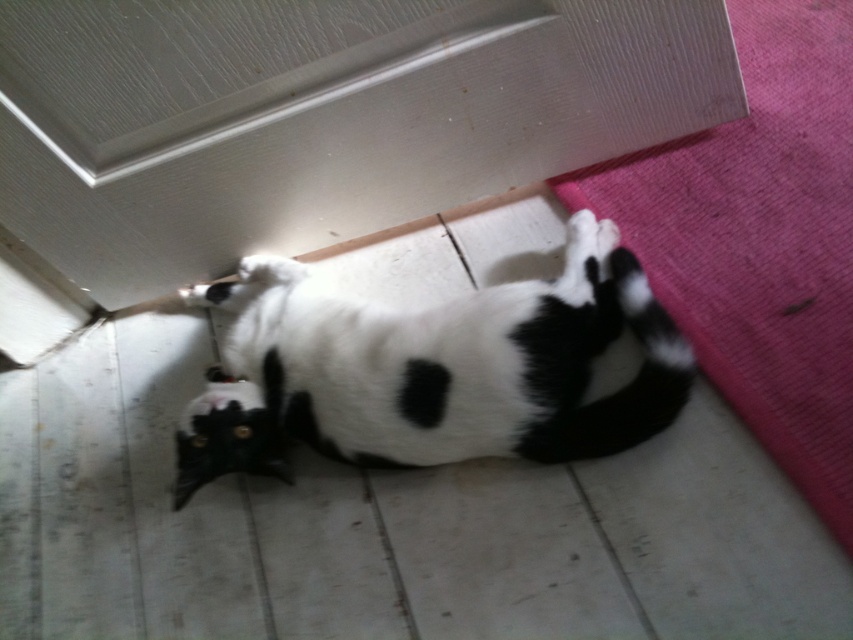
You are a photographer trying to capture a clear photo of the black and white fur cat at center and the pink fabric mat at lower right. Which object is closer to the camera lens?

The black and white fur cat at center is closer to the camera lens than the pink fabric mat at lower right because it is further to the viewer.

What are the coordinates of the black and white fur cat at center?

The black and white fur cat at center is located at point (x=431, y=369).